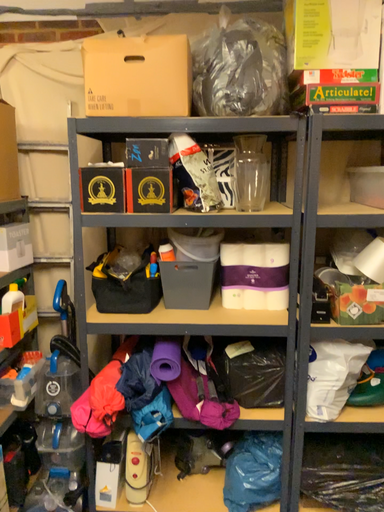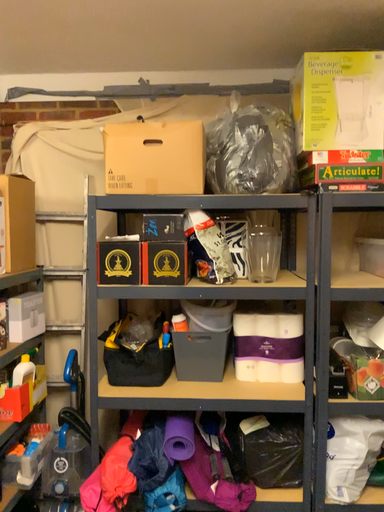
Question: Which way did the camera rotate in the video?

Choices:
 (A) rotated upward
 (B) rotated downward

Answer: (A)